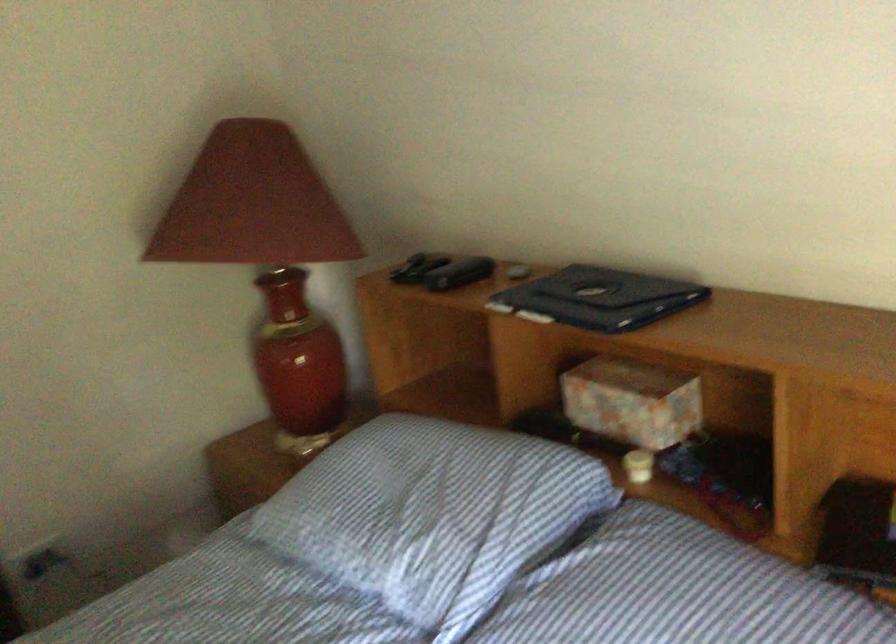
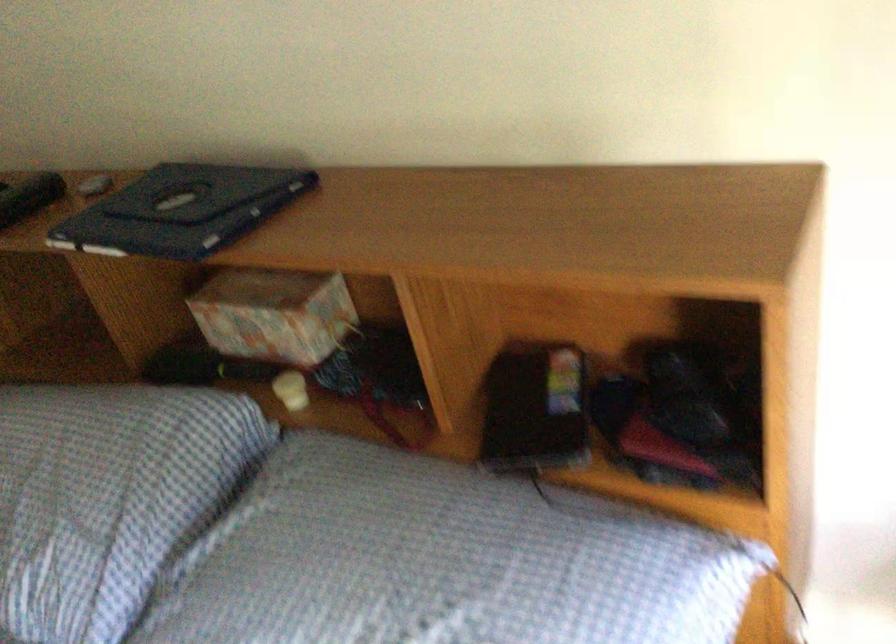
Which direction would the cameraman need to move to produce the second image?

The cameraman moved toward right, forward.